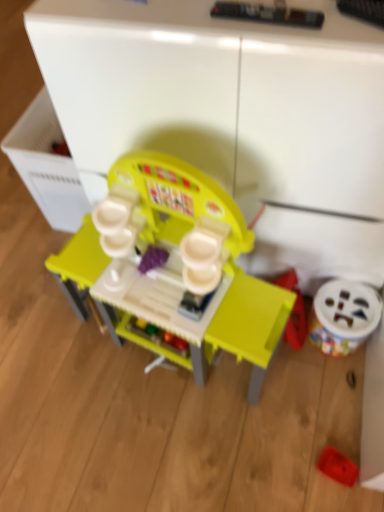
Where is `free space in front of matte plastic play kitchen at center, positioned as the 3th toy in right-to-left order`? Image resolution: width=384 pixels, height=512 pixels. free space in front of matte plastic play kitchen at center, positioned as the 3th toy in right-to-left order is located at coordinates (181, 445).